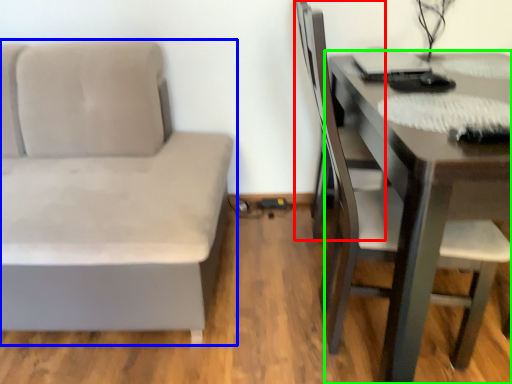
Question: Which is nearer to the swivel chair (highlighted by a red box)? studio couch (highlighted by a blue box) or table (highlighted by a green box).

Choices:
 (A) studio couch
 (B) table

Answer: (B)